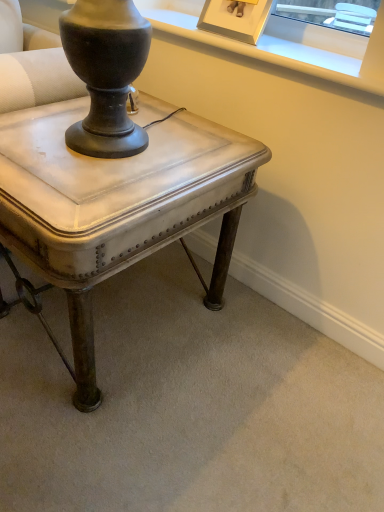
You are a GUI agent. You are given a task and a screenshot of the screen. Output one action in this format:
    pyautogui.click(x=<x>, y=<y>)
    Task: Click on the vacant area that lies to the right of gold-framed picture at upper center
    
    Given the screenshot: What is the action you would take?
    pyautogui.click(x=306, y=46)